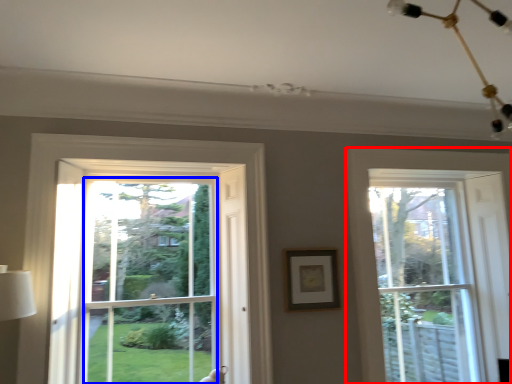
Question: Which object is closer to the camera taking this photo, window (highlighted by a red box) or window screen (highlighted by a blue box)?

Choices:
 (A) window
 (B) window screen

Answer: (B)